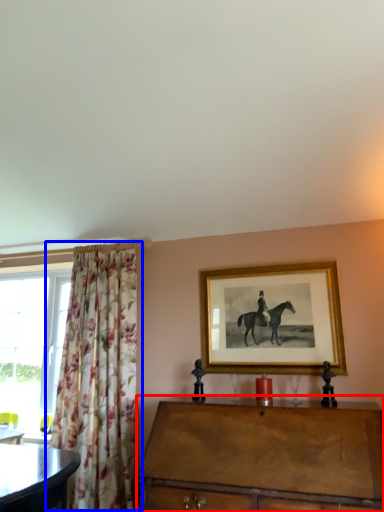
Question: Which object is closer to the camera taking this photo, chest of drawers (highlighted by a red box) or curtain (highlighted by a blue box)?

Choices:
 (A) chest of drawers
 (B) curtain

Answer: (A)